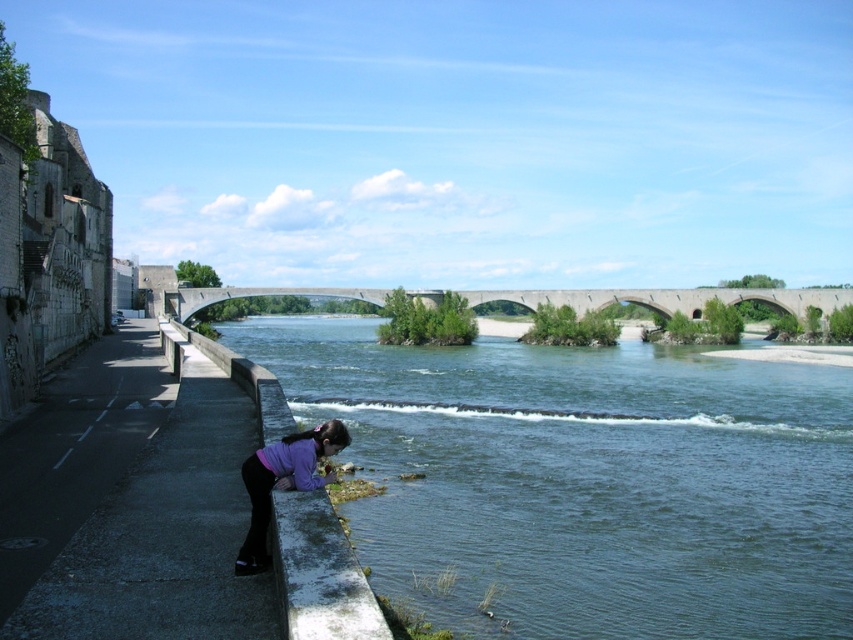
How much distance is there between greenish-blue water at center and concrete bridge at center?

greenish-blue water at center is 32.83 meters from concrete bridge at center.

Does greenish-blue water at center have a greater height compared to concrete bridge at center?

No, greenish-blue water at center is not taller than concrete bridge at center.

The width and height of the screenshot is (853, 640). I want to click on greenish-blue water at center, so click(x=584, y=481).

Identify the location of greenish-blue water at center. (584, 481).

Between greenish-blue water at center and purple matte shirt at lower center, which one appears on the left side from the viewer's perspective?

purple matte shirt at lower center

Image resolution: width=853 pixels, height=640 pixels. Describe the element at coordinates (584, 481) in the screenshot. I see `greenish-blue water at center` at that location.

Image resolution: width=853 pixels, height=640 pixels. What do you see at coordinates (584, 481) in the screenshot? I see `greenish-blue water at center` at bounding box center [584, 481].

Identify the location of greenish-blue water at center. (584, 481).

Does concrete bridge at center have a smaller size compared to purple matte shirt at lower center?

No, concrete bridge at center is not smaller than purple matte shirt at lower center.

Measure the distance between concrete bridge at center and camera.

A distance of 98.29 meters exists between concrete bridge at center and camera.

Where is `concrete bridge at center`? The width and height of the screenshot is (853, 640). concrete bridge at center is located at coordinates (669, 298).